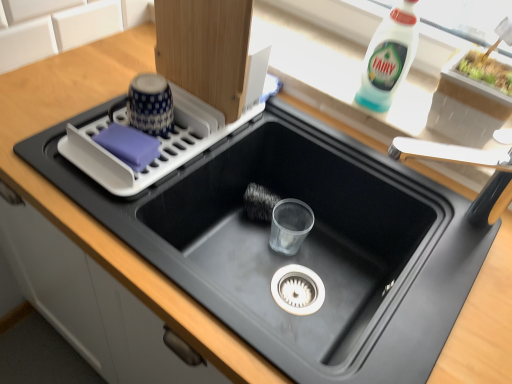
Where is `vacant space situated on the left part of white plastic bottle at upper right`? The image size is (512, 384). vacant space situated on the left part of white plastic bottle at upper right is located at coordinates (317, 71).